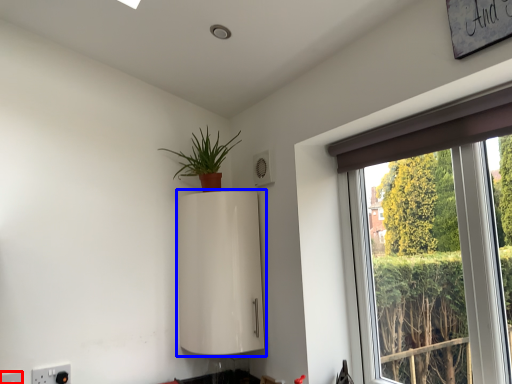
Question: Among these objects, which one is farthest to the camera, electric outlet (highlighted by a red box) or appliance (highlighted by a blue box)?

Choices:
 (A) electric outlet
 (B) appliance

Answer: (B)